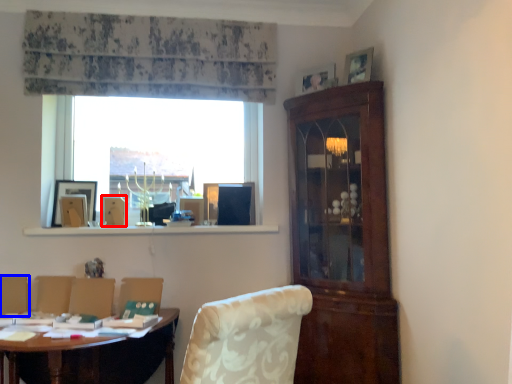
Question: Which object appears farthest to the camera in this image, picture frame (highlighted by a red box) or armchair (highlighted by a blue box)?

Choices:
 (A) picture frame
 (B) armchair

Answer: (A)